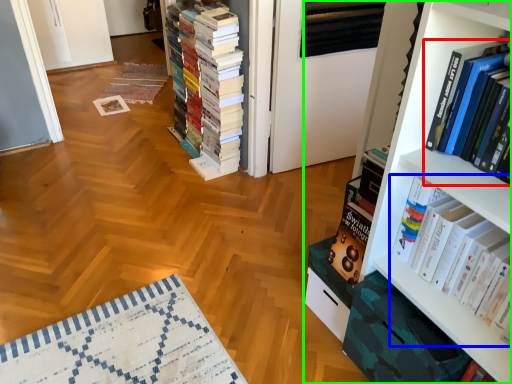
Question: Which is nearer to the book (highlighted by a red box)? book (highlighted by a blue box) or bookcase (highlighted by a green box).

Choices:
 (A) book
 (B) bookcase

Answer: (B)